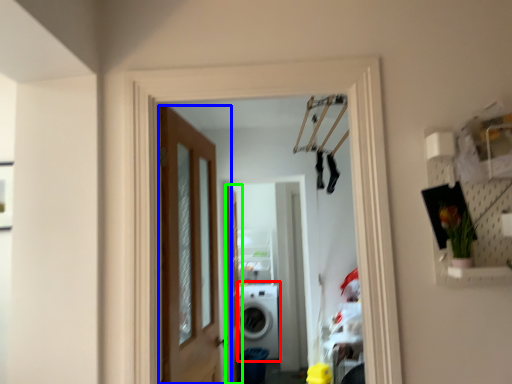
Question: Which object is positioned farthest from washing machine (highlighted by a red box)? Select from door (highlighted by a blue box) and screen door (highlighted by a green box).

Choices:
 (A) door
 (B) screen door

Answer: (A)